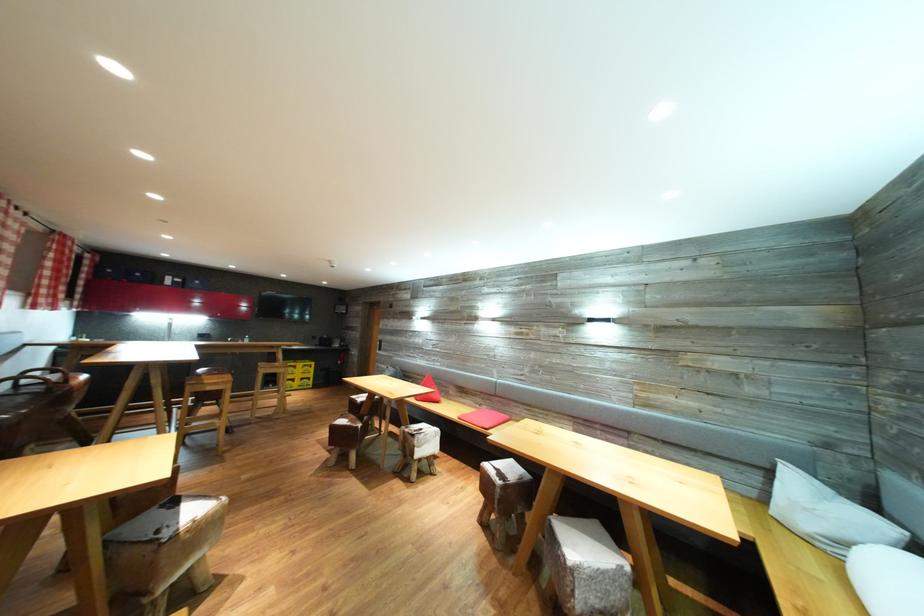
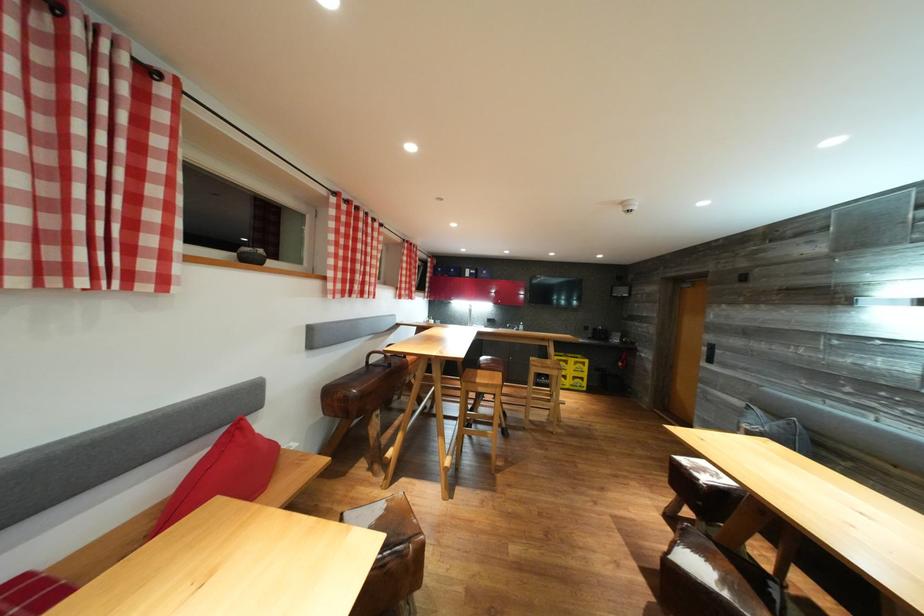
In the second image, find the point that corresponds to pixel 360 402 in the first image.

(689, 466)